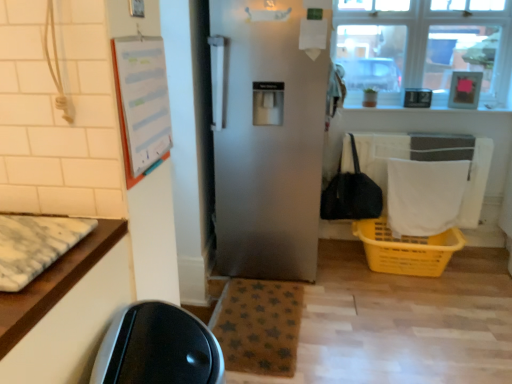
Describe the element at coordinates (35, 245) in the screenshot. I see `white marble mat at left, positioned as the second mat in bottom-to-top order` at that location.

Describe the element at coordinates (406, 249) in the screenshot. I see `yellow plastic basket at lower right` at that location.

In order to face satin silver refrigerator at center, should I rotate leftwards or rightwards?

To face it directly, rotate right by 2.688 degrees.

Measure the distance between black fabric handbag at right and camera.

black fabric handbag at right is 8.83 feet from camera.

Identify the location of brown star-patterned mat at lower center, the second mat viewed from the front. (259, 326).

From the picture: How much space does brown star-patterned mat at lower center, which ranks as the second mat in left-to-right order, occupy horizontally?

brown star-patterned mat at lower center, which ranks as the second mat in left-to-right order, is 15.30 inches wide.

Locate an element on the screen. clear glass window at upper right is located at coordinates (424, 47).

Locate an element on the screen. Image resolution: width=512 pixels, height=384 pixels. white fabric laundry at lower right is located at coordinates (424, 196).

Considering the positions of objects clear glass window at upper right and white paperboard at upper left in the image provided, who is more to the left, clear glass window at upper right or white paperboard at upper left?

Positioned to the left is white paperboard at upper left.

Would you say clear glass window at upper right is outside white paperboard at upper left?

Absolutely, clear glass window at upper right is external to white paperboard at upper left.

Considering the points (381, 2) and (114, 66), which point is in front, point (381, 2) or point (114, 66)?

The point (114, 66) is closer to the camera.

Is clear glass window at upper right oriented away from white paperboard at upper left?

No, white paperboard at upper left is not at the back of clear glass window at upper right.

Considering the relative sizes of white marble mat at left, which ranks as the 1th mat in front-to-back order, and white fabric laundry at lower right in the image provided, is white marble mat at left, which ranks as the 1th mat in front-to-back order, smaller than white fabric laundry at lower right?

Yes.

Is point (77, 230) less distant than point (395, 161)?

Yes, it is.

Is white marble mat at left, arranged as the 1th mat when viewed from the top, turned away from white fabric laundry at lower right?

white marble mat at left, arranged as the 1th mat when viewed from the top, is not turned away from white fabric laundry at lower right.

Is the surface of white marble mat at left, arranged as the 1th mat when viewed from the top, in direct contact with white fabric laundry at lower right?

No, white marble mat at left, arranged as the 1th mat when viewed from the top, is not making contact with white fabric laundry at lower right.

Does white marble mat at left, positioned as the second mat in bottom-to-top order, have a smaller size compared to white paperboard at upper left?

No, white marble mat at left, positioned as the second mat in bottom-to-top order, is not smaller than white paperboard at upper left.

From the image's perspective, would you say white marble mat at left, positioned as the second mat in bottom-to-top order, is positioned over white paperboard at upper left?

Actually, white marble mat at left, positioned as the second mat in bottom-to-top order, appears below white paperboard at upper left in the image.

Locate an element on the screen. This screenshot has width=512, height=384. bulletin board lying on the right of white marble mat at left, the second mat in the right-to-left sequence is located at coordinates (141, 103).

How different are the orientations of white marble mat at left, which ranks as the first mat in left-to-right order, and white paperboard at upper left in degrees?

92.2 degrees.

Measure the distance from yellow plastic basket at lower right to clear glass window at upper right.

3.50 feet.

From the image's perspective, is yellow plastic basket at lower right beneath clear glass window at upper right?

Yes, from the image's perspective, yellow plastic basket at lower right is below clear glass window at upper right.

Can we say yellow plastic basket at lower right lies outside clear glass window at upper right?

Yes, yellow plastic basket at lower right is located beyond the bounds of clear glass window at upper right.

Is yellow plastic basket at lower right positioned behind clear glass window at upper right?

No, yellow plastic basket at lower right is closer to the viewer.

Is point (274, 277) closer or farther from the camera than point (36, 265)?

Clearly, point (274, 277) is more distant from the camera than point (36, 265).

Could you measure the distance between satin silver refrigerator at center and white marble mat at left, arranged as the 1th mat when viewed from the top?

The distance of satin silver refrigerator at center from white marble mat at left, arranged as the 1th mat when viewed from the top, is 1.41 meters.

Is the depth of satin silver refrigerator at center greater than that of white marble mat at left, the second mat viewed from the back?

Yes, satin silver refrigerator at center is further from the viewer.

Can you confirm if satin silver refrigerator at center is smaller than white marble mat at left, the second mat in the right-to-left sequence?

Actually, satin silver refrigerator at center might be larger than white marble mat at left, the second mat in the right-to-left sequence.

Could you tell me if clear glass window at upper right is facing satin silver refrigerator at center?

No.

Is point (360, 12) closer or farther from the camera than point (288, 69)?

Point (360, 12) appears to be farther away from the viewer than point (288, 69).

Can you confirm if clear glass window at upper right is shorter than satin silver refrigerator at center?

Yes.

Considering the sizes of objects clear glass window at upper right and satin silver refrigerator at center in the image provided, who is wider, clear glass window at upper right or satin silver refrigerator at center?

satin silver refrigerator at center is wider.

Is white fabric laundry at lower right next to brown star-patterned mat at lower center, the second mat viewed from the front?

white fabric laundry at lower right and brown star-patterned mat at lower center, the second mat viewed from the front, are not in contact.

From the image's perspective, which is above, white fabric laundry at lower right or brown star-patterned mat at lower center, positioned as the second mat in top-to-bottom order?

white fabric laundry at lower right appears higher in the image.

Based on the photo, which of these two, white fabric laundry at lower right or brown star-patterned mat at lower center, which ranks as the first mat in bottom-to-top order, is thinner?

white fabric laundry at lower right.

Which point is more forward, (412,231) or (224,320)?

The point (224,320) is closer.

In the image, there is a clear glass window at upper right. Identify the location of bulletin board below it (from the image's perspective). (141, 103).

Which mat is the 2nd one when counting from the front of the white fabric laundry at lower right? Please provide its 2D coordinates.

[(35, 245)]

Estimate the real-world distances between objects in this image. Which object is further from white marble mat at left, arranged as the 1th mat when viewed from the top, clear glass window at upper right or brown star-patterned mat at lower center, the second mat viewed from the front?

Among the two, clear glass window at upper right is located further to white marble mat at left, arranged as the 1th mat when viewed from the top.

Which object lies nearer to the anchor point black fabric handbag at right, clear glass window at upper right or satin silver refrigerator at center?

Based on the image, satin silver refrigerator at center appears to be nearer to black fabric handbag at right.

Which object lies further to the anchor point satin silver refrigerator at center, yellow plastic basket at lower right or brown star-patterned mat at lower center, which ranks as the second mat in left-to-right order?

Based on the image, yellow plastic basket at lower right appears to be further to satin silver refrigerator at center.

Considering their positions, is black fabric handbag at right positioned closer to white paperboard at upper left than brown star-patterned mat at lower center, the 1th mat when ordered from back to front?

brown star-patterned mat at lower center, the 1th mat when ordered from back to front.

Looking at the image, which one is located further to black fabric handbag at right, satin silver refrigerator at center or brown star-patterned mat at lower center, positioned as the second mat in top-to-bottom order?

The object further to black fabric handbag at right is brown star-patterned mat at lower center, positioned as the second mat in top-to-bottom order.

Estimate the real-world distances between objects in this image. Which object is closer to brown star-patterned mat at lower center, acting as the first mat starting from the right, white paperboard at upper left or white fabric laundry at lower right?

The object closer to brown star-patterned mat at lower center, acting as the first mat starting from the right, is white fabric laundry at lower right.

When comparing their distances from brown star-patterned mat at lower center, positioned as the second mat in top-to-bottom order, does white fabric laundry at lower right or white marble mat at left, which ranks as the 1th mat in front-to-back order, seem closer?

white fabric laundry at lower right lies closer to brown star-patterned mat at lower center, positioned as the second mat in top-to-bottom order, than the other object.

From the image, which object appears to be farther from yellow plastic basket at lower right, clear glass window at upper right or white paperboard at upper left?

The object further to yellow plastic basket at lower right is white paperboard at upper left.

At what (x,y) coordinates should I click in order to perform the action: click on refrigerator between white marble mat at left, which ranks as the first mat in left-to-right order, and black fabric handbag at right from front to back. Please return your answer as a coordinate pair (x, y). This screenshot has width=512, height=384. Looking at the image, I should click on (268, 142).

Locate an element on the screen. mat between white paperboard at upper left and black fabric handbag at right from front to back is located at coordinates (259, 326).

At what (x,y) coordinates should I click in order to perform the action: click on bulletin board between satin silver refrigerator at center and brown star-patterned mat at lower center, the second mat viewed from the front, in the up-down direction. Please return your answer as a coordinate pair (x, y). Looking at the image, I should click on (141, 103).

Locate an element on the screen. The image size is (512, 384). handbag between brown star-patterned mat at lower center, the 1th mat when ordered from back to front, and white fabric laundry at lower right is located at coordinates (351, 194).